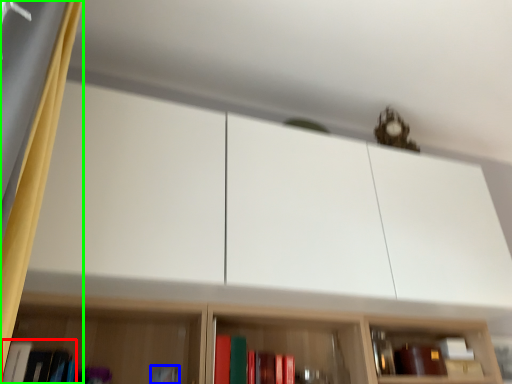
Question: Estimate the real-world distances between objects in this image. Which object is closer to book (highlighted by a red box), book (highlighted by a blue box) or curtain (highlighted by a green box)?

Choices:
 (A) book
 (B) curtain

Answer: (A)